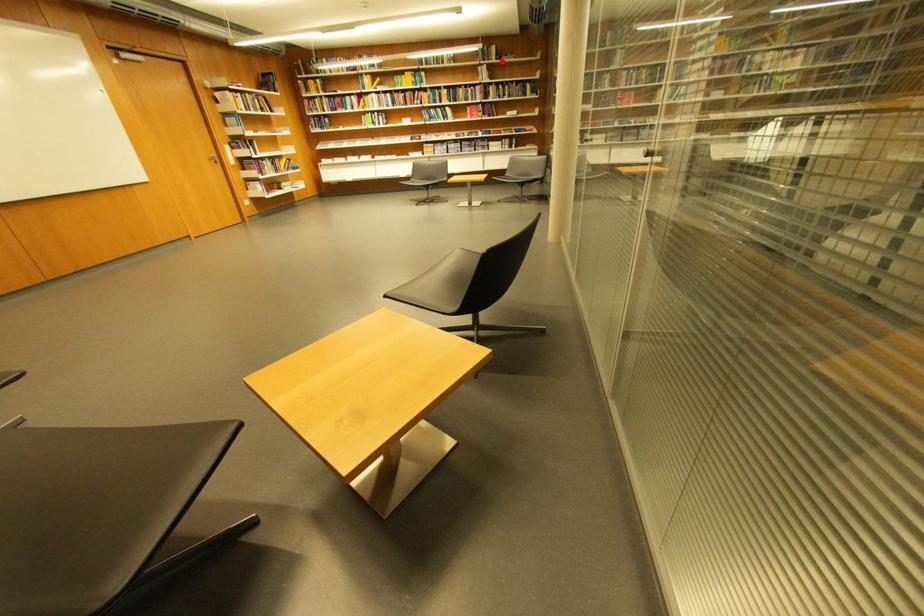
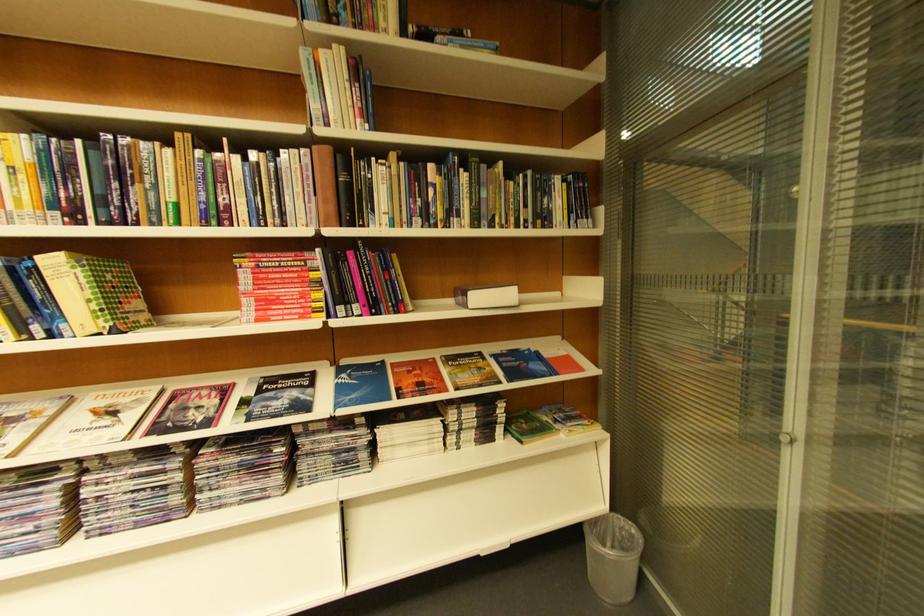
Find the pixel in the second image that matches the highlighted location in the first image.

(384, 31)